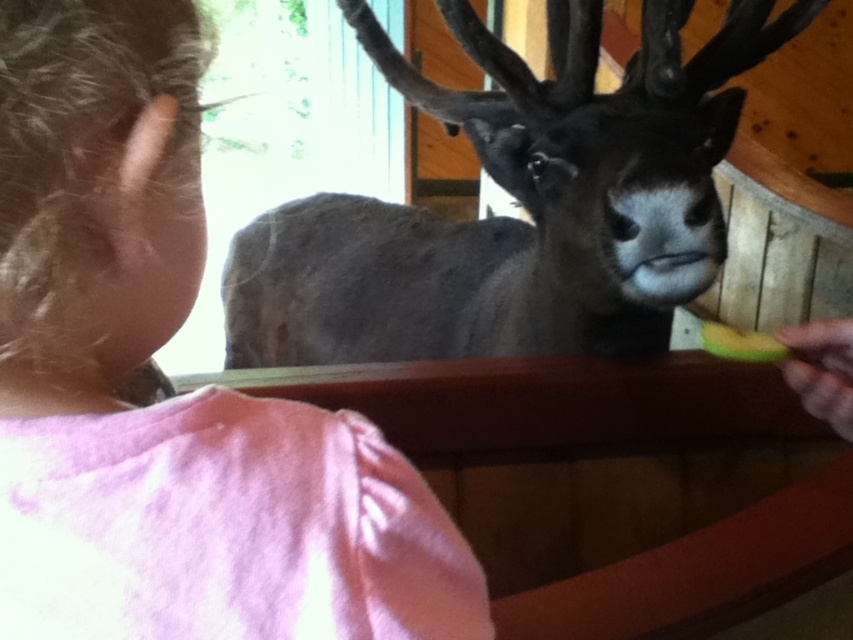
Based on the photo, you are standing in the room where the child and the deer are. You need to place a small stool so that it is exactly between the pink fabric shirt at upper left and the window. Can you determine the coordinates where the stool should be placed?

The pink fabric shirt at upper left is located at point (172, 397). The window is at point (679, 241). The midpoint between them is at (426, 320), so place the stool there.

Consider the image. You are a photographer trying to capture a candid moment of the pink fabric shirt at upper left and the dark brown fur at center in the scene. To ensure both subjects are in frame, should you adjust your camera to focus more to the left or the right?

The pink fabric shirt at upper left is to the left of dark brown fur at center, so to include both subjects in the frame, you should adjust the camera to focus more to the left to capture the pink fabric shirt at upper left and then pan towards the right to include the dark brown fur at center.

You are a photographer trying to capture a candid shot of the child and the animal. Since the pink fabric shirt at upper left is positioned under the dark brown fur at center, where should you adjust your camera angle to ensure both subjects are fully visible in the frame?

To ensure both the pink fabric shirt at upper left and the dark brown fur at center are fully visible, you should position the camera slightly below the dark brown fur at center so that the pink fabric shirt at upper left is not obscured.